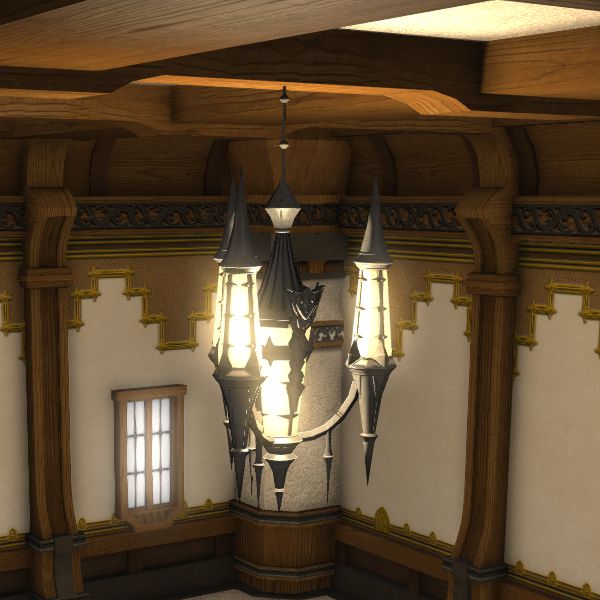
What are the coordinates of `chandelier` in the screenshot? It's located at (293, 360).